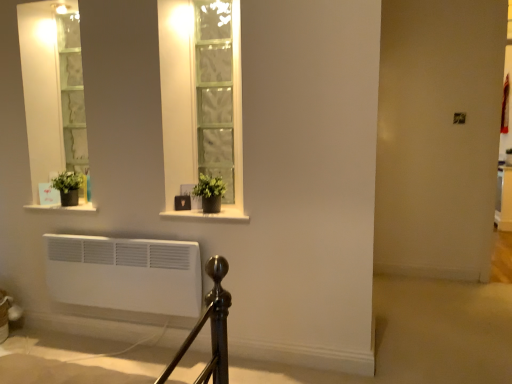
Describe the element at coordinates (63, 207) in the screenshot. I see `matte black pot at lower left, which is the first window sill from left to right` at that location.

Describe the element at coordinates (210, 192) in the screenshot. The width and height of the screenshot is (512, 384). I see `green matte plant at center, placed as the first houseplant when sorted from front to back` at that location.

You are a GUI agent. You are given a task and a screenshot of the screen. Output one action in this format:
    pyautogui.click(x=<x>, y=<y>)
    Task: Click on the matte black pot at center, which appears as the first window sill when viewed from the right
    This screenshot has width=512, height=384.
    Given the screenshot: What is the action you would take?
    pyautogui.click(x=209, y=214)

Considering the sizes of objects matte black pot at lower left, placed as the 2th window sill when sorted from right to left, and green matte plant at left, which appears as the 2th houseplant when viewed from the right, in the image provided, who is wider, matte black pot at lower left, placed as the 2th window sill when sorted from right to left, or green matte plant at left, which appears as the 2th houseplant when viewed from the right,?

matte black pot at lower left, placed as the 2th window sill when sorted from right to left.

Which object is closer to the camera, matte black pot at lower left, which is the first window sill from left to right, or green matte plant at left, the first houseplant in the back-to-front sequence?

matte black pot at lower left, which is the first window sill from left to right, is closer to the camera.

Looking at this image, is matte black pot at lower left, placed as the 2th window sill when sorted from right to left, spatially inside green matte plant at left, which appears as the 1th houseplant when viewed from the left, or outside of it?

matte black pot at lower left, placed as the 2th window sill when sorted from right to left, lies outside green matte plant at left, which appears as the 1th houseplant when viewed from the left.

Looking at this image, between matte black pot at lower left, placed as the 2th window sill when sorted from right to left, and green matte plant at left, which appears as the second houseplant when viewed from the front, which one appears on the left side from the viewer's perspective?

From the viewer's perspective, matte black pot at lower left, placed as the 2th window sill when sorted from right to left, appears more on the left side.

Is green matte plant at center, which is the 2th houseplant in left-to-right order, turned away from matte black pot at lower left, placed as the 2th window sill when sorted from right to left?

No, green matte plant at center, which is the 2th houseplant in left-to-right order, is not facing the opposite direction of matte black pot at lower left, placed as the 2th window sill when sorted from right to left.

What's the angular difference between green matte plant at center, placed as the first houseplant when sorted from front to back, and matte black pot at lower left, which is the first window sill from left to right,'s facing directions?

They differ by 0.867 degrees in their facing directions.

From a real-world perspective, does green matte plant at center, the second houseplant in the back-to-front sequence, stand above matte black pot at lower left, which is the first window sill from left to right?

Correct, in the physical world, green matte plant at center, the second houseplant in the back-to-front sequence, is higher than matte black pot at lower left, which is the first window sill from left to right.

Looking at their sizes, would you say green matte plant at center, which is counted as the 1th houseplant, starting from the right, is wider or thinner than matte black pot at lower left, placed as the 2th window sill when sorted from right to left?

Clearly, green matte plant at center, which is counted as the 1th houseplant, starting from the right, has less width compared to matte black pot at lower left, placed as the 2th window sill when sorted from right to left.

Is matte black pot at center, the 2th window sill positioned from the left, inside or outside of green matte plant at left, which appears as the second houseplant when viewed from the front?

matte black pot at center, the 2th window sill positioned from the left, is located beyond the bounds of green matte plant at left, which appears as the second houseplant when viewed from the front.

From the image's perspective, between matte black pot at center, the 2th window sill positioned from the left, and green matte plant at left, which appears as the second houseplant when viewed from the front, which one is located above?

green matte plant at left, which appears as the second houseplant when viewed from the front, is shown above in the image.

At what (x,y) coordinates should I click in order to perform the action: click on the 2nd window sill in front when counting from the green matte plant at left, which appears as the 1th houseplant when viewed from the left. Please return your answer as a coordinate pair (x, y). Image resolution: width=512 pixels, height=384 pixels. Looking at the image, I should click on (209, 214).

Which is more to the right, matte black pot at center, which appears as the first window sill when viewed from the right, or green matte plant at left, which appears as the second houseplant when viewed from the front?

matte black pot at center, which appears as the first window sill when viewed from the right, is more to the right.

Is green matte plant at left, which appears as the 1th houseplant when viewed from the left, thinner than matte black pot at center, which appears as the first window sill when viewed from the right?

Yes, green matte plant at left, which appears as the 1th houseplant when viewed from the left, is thinner than matte black pot at center, which appears as the first window sill when viewed from the right.

At what (x,y) coordinates should I click in order to perform the action: click on the 2nd window sill directly beneath the green matte plant at left, the first houseplant in the back-to-front sequence (from a real-world perspective). Please return your answer as a coordinate pair (x, y). The height and width of the screenshot is (384, 512). Looking at the image, I should click on (209, 214).

Measure the distance from green matte plant at left, the first houseplant in the back-to-front sequence, to matte black pot at center, the 2th window sill positioned from the left.

76.40 centimeters.

Is green matte plant at left, which appears as the second houseplant when viewed from the front, aimed at matte black pot at lower left, which is the first window sill from left to right?

No, green matte plant at left, which appears as the second houseplant when viewed from the front, is not facing towards matte black pot at lower left, which is the first window sill from left to right.

From the image's perspective, which one is positioned lower, green matte plant at left, which appears as the 1th houseplant when viewed from the left, or matte black pot at lower left, which is the first window sill from left to right?

matte black pot at lower left, which is the first window sill from left to right.

Can you confirm if green matte plant at left, which appears as the 1th houseplant when viewed from the left, is smaller than matte black pot at lower left, placed as the 2th window sill when sorted from right to left?

Indeed, green matte plant at left, which appears as the 1th houseplant when viewed from the left, has a smaller size compared to matte black pot at lower left, placed as the 2th window sill when sorted from right to left.

Who is shorter, green matte plant at center, placed as the first houseplant when sorted from front to back, or green matte plant at left, which appears as the 2th houseplant when viewed from the right?

Standing shorter between the two is green matte plant at left, which appears as the 2th houseplant when viewed from the right.

From a real-world perspective, which is physically below, green matte plant at center, the second houseplant in the back-to-front sequence, or green matte plant at left, the first houseplant in the back-to-front sequence?

From a 3D spatial view, green matte plant at left, the first houseplant in the back-to-front sequence, is below.

Can you tell me how much green matte plant at center, which is counted as the 1th houseplant, starting from the right, and green matte plant at left, which appears as the 2th houseplant when viewed from the right, differ in facing direction?

There is a 1.84-degree angle between the facing directions of green matte plant at center, which is counted as the 1th houseplant, starting from the right, and green matte plant at left, which appears as the 2th houseplant when viewed from the right.

Can you confirm if green matte plant at center, placed as the first houseplant when sorted from front to back, is positioned to the right of matte black pot at center, which appears as the first window sill when viewed from the right?

Incorrect, green matte plant at center, placed as the first houseplant when sorted from front to back, is not on the right side of matte black pot at center, which appears as the first window sill when viewed from the right.

In the scene shown: Which point is more forward, (220,206) or (238,221)?

Point (238,221)

What's the angular difference between green matte plant at center, which is counted as the 1th houseplant, starting from the right, and matte black pot at center, the 2th window sill positioned from the left,'s facing directions?

There is a 0.867-degree angle between the facing directions of green matte plant at center, which is counted as the 1th houseplant, starting from the right, and matte black pot at center, the 2th window sill positioned from the left.

Is green matte plant at center, which is counted as the 1th houseplant, starting from the right, closer to camera compared to matte black pot at center, the 2th window sill positioned from the left?

No, green matte plant at center, which is counted as the 1th houseplant, starting from the right, is further to the viewer.

The height and width of the screenshot is (384, 512). I want to click on houseplant behind the matte black pot at lower left, which is the first window sill from left to right, so click(x=68, y=187).

At what (x,y) coordinates should I click in order to perform the action: click on the 2nd houseplant counting from the right side of the matte black pot at lower left, which is the first window sill from left to right. Please return your answer as a coordinate pair (x, y). The image size is (512, 384). Looking at the image, I should click on (210, 192).

When comparing their distances from matte black pot at center, which appears as the first window sill when viewed from the right, does green matte plant at center, which is counted as the 1th houseplant, starting from the right, or matte black pot at lower left, which is the first window sill from left to right, seem closer?

green matte plant at center, which is counted as the 1th houseplant, starting from the right.

Estimate the real-world distances between objects in this image. Which object is further from green matte plant at left, which appears as the 1th houseplant when viewed from the left, matte black pot at lower left, placed as the 2th window sill when sorted from right to left, or matte black pot at center, the 2th window sill positioned from the left?

The object further to green matte plant at left, which appears as the 1th houseplant when viewed from the left, is matte black pot at center, the 2th window sill positioned from the left.

From the image, which object appears to be farther from matte black pot at lower left, placed as the 2th window sill when sorted from right to left, green matte plant at left, which appears as the 1th houseplant when viewed from the left, or matte black pot at center, the 2th window sill positioned from the left?

matte black pot at center, the 2th window sill positioned from the left, is further to matte black pot at lower left, placed as the 2th window sill when sorted from right to left.

When comparing their distances from green matte plant at left, which appears as the 1th houseplant when viewed from the left, does matte black pot at center, which appears as the first window sill when viewed from the right, or green matte plant at center, which is the 2th houseplant in left-to-right order, seem closer?

matte black pot at center, which appears as the first window sill when viewed from the right.

From the image, which object appears to be farther from green matte plant at center, the second houseplant in the back-to-front sequence, green matte plant at left, which appears as the 1th houseplant when viewed from the left, or matte black pot at lower left, which is the first window sill from left to right?

green matte plant at left, which appears as the 1th houseplant when viewed from the left, is further to green matte plant at center, the second houseplant in the back-to-front sequence.

Looking at the image, which one is located closer to green matte plant at left, which appears as the 1th houseplant when viewed from the left, green matte plant at center, which is the 2th houseplant in left-to-right order, or matte black pot at lower left, placed as the 2th window sill when sorted from right to left?

Based on the image, matte black pot at lower left, placed as the 2th window sill when sorted from right to left, appears to be nearer to green matte plant at left, which appears as the 1th houseplant when viewed from the left.

When comparing their distances from green matte plant at center, which is the 2th houseplant in left-to-right order, does green matte plant at left, which appears as the 1th houseplant when viewed from the left, or matte black pot at center, the 2th window sill positioned from the left, seem further?

Based on the image, green matte plant at left, which appears as the 1th houseplant when viewed from the left, appears to be further to green matte plant at center, which is the 2th houseplant in left-to-right order.

Looking at the image, which one is located further to green matte plant at left, which appears as the second houseplant when viewed from the front, green matte plant at center, which is counted as the 1th houseplant, starting from the right, or matte black pot at center, the 2th window sill positioned from the left?

green matte plant at center, which is counted as the 1th houseplant, starting from the right.

This screenshot has width=512, height=384. Identify the location of houseplant between green matte plant at left, which appears as the 1th houseplant when viewed from the left, and matte black pot at center, which appears as the first window sill when viewed from the right. (210, 192).

Identify the location of houseplant located between matte black pot at lower left, which is the first window sill from left to right, and green matte plant at center, which is counted as the 1th houseplant, starting from the right, in the left-right direction. The width and height of the screenshot is (512, 384). (68, 187).